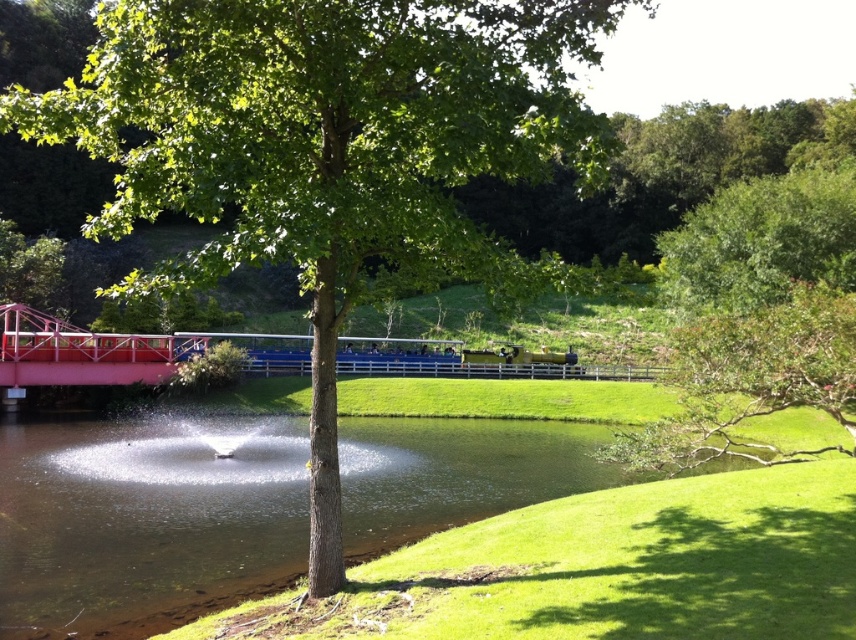
Can you confirm if green leafy tree at center is bigger than green leafy tree at upper right?

Yes.

Is point (480, 65) more distant than point (699, 424)?

No, (480, 65) is closer to viewer.

You are a GUI agent. You are given a task and a screenshot of the screen. Output one action in this format:
    pyautogui.click(x=<x>, y=<y>)
    Task: Click on the green leafy tree at center
    
    Given the screenshot: What is the action you would take?
    pyautogui.click(x=325, y=147)